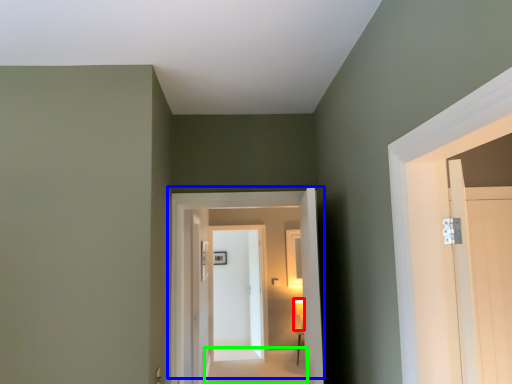
Question: Which is nearer to the light fixture (highlighted by a red box)? door (highlighted by a blue box) or path (highlighted by a green box).

Choices:
 (A) door
 (B) path

Answer: (B)